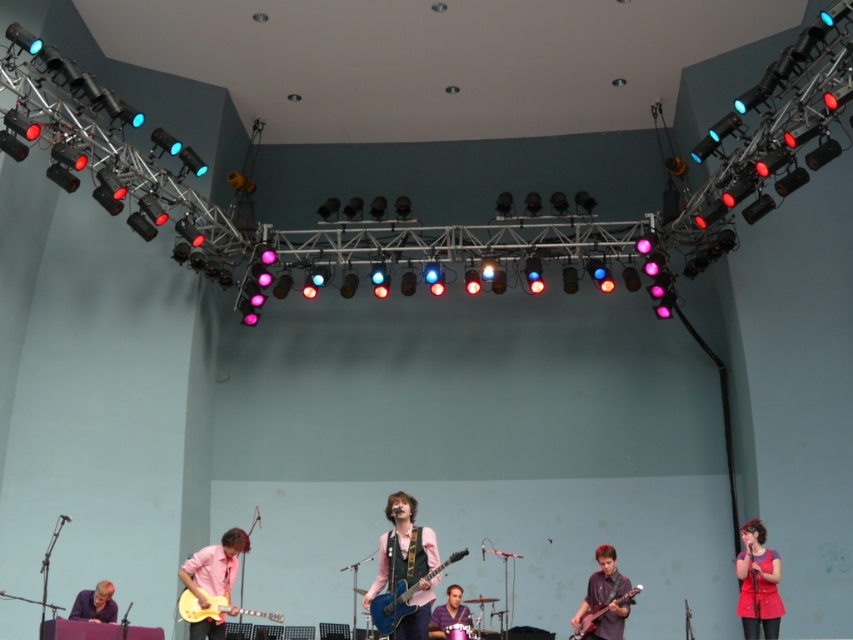
Does matte red vest at lower right appear over pink matte guitar at lower left?

Incorrect, matte red vest at lower right is not positioned above pink matte guitar at lower left.

Is point (744, 602) behind point (212, 547)?

Yes, it is.

Find the location of a particular element. matte red vest at lower right is located at coordinates (758, 582).

Can you confirm if pink matte shirt at center is wider than pink matte guitar at lower left?

Yes.

Does pink matte shirt at center appear on the left side of pink matte guitar at lower left?

Incorrect, pink matte shirt at center is not on the left side of pink matte guitar at lower left.

Describe the element at coordinates (405, 563) in the screenshot. I see `pink matte shirt at center` at that location.

Locate an element on the screen. pink matte shirt at center is located at coordinates (405, 563).

Where is `blue glossy guitar at center`? This screenshot has width=853, height=640. blue glossy guitar at center is located at coordinates (393, 605).

Between point (390, 612) and point (96, 595), which one is positioned behind?

The point (96, 595) is behind.

In order to click on blue glossy guitar at center in this screenshot , I will do `click(393, 605)`.